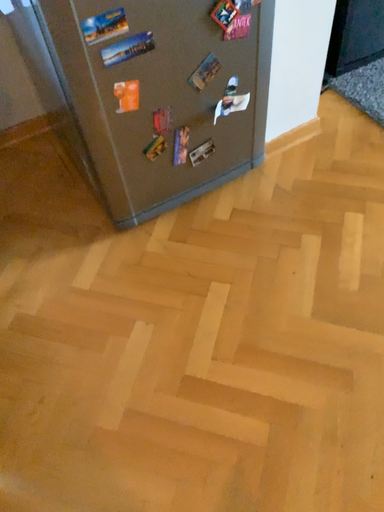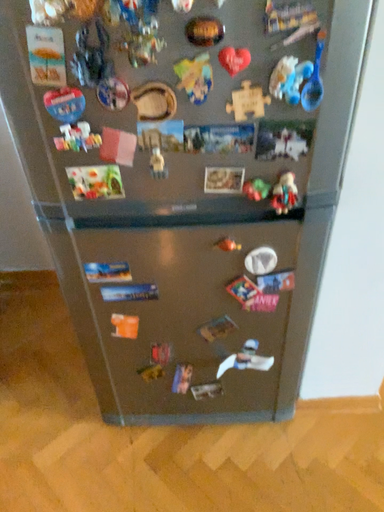
Question: Which way did the camera rotate in the video?

Choices:
 (A) rotated upward
 (B) rotated downward

Answer: (A)